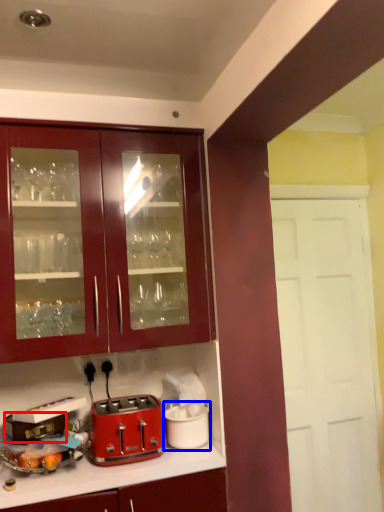
Question: Which of the following is the closest to the observer, appliance (highlighted by a red box) or appliance (highlighted by a blue box)?

Choices:
 (A) appliance
 (B) appliance

Answer: (A)